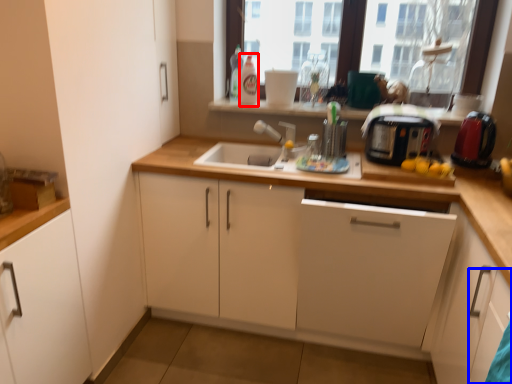
Question: Which of the following is the closest to the observer, bottle (highlighted by a red box) or cabinetry (highlighted by a blue box)?

Choices:
 (A) bottle
 (B) cabinetry

Answer: (B)